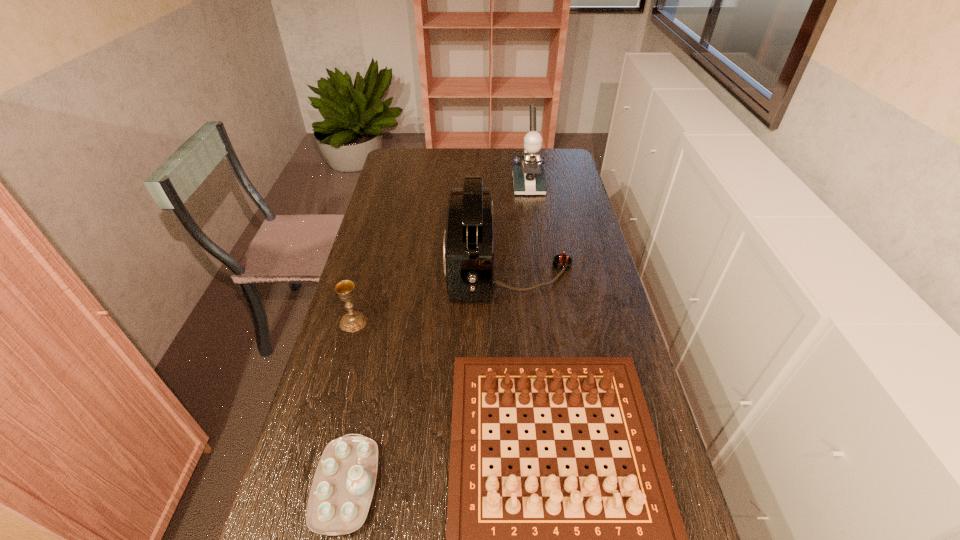
At what (x,y) coordinates should I click in order to perform the action: click on free area in between the chinaware and the microscope. Please return your answer as a coordinate pair (x, y). This screenshot has height=540, width=960. Looking at the image, I should click on (437, 336).

Where is `vacant area that lies between the chinaware and the chalice`? The height and width of the screenshot is (540, 960). vacant area that lies between the chinaware and the chalice is located at coordinates (349, 404).

The image size is (960, 540). In order to click on free space between the second farthest object and the shortest object in this screenshot , I will do (x=428, y=377).

Identify the location of free spot between the radio receiver and the chinaware. This screenshot has height=540, width=960. (428, 377).

Locate an element on the screen. The height and width of the screenshot is (540, 960). the third closest object to the shortest object is located at coordinates (468, 245).

You are a GUI agent. You are given a task and a screenshot of the screen. Output one action in this format:
    pyautogui.click(x=<x>, y=<y>)
    Task: Click on the object that is the second closest to the gameboard
    
    Given the screenshot: What is the action you would take?
    pyautogui.click(x=468, y=245)

Locate an element on the screen. This screenshot has height=540, width=960. free space that satisfies the following two spatial constraints: 1. on the front side of the chinaware; 2. on the right side of the third shortest object is located at coordinates (308, 486).

You are a GUI agent. You are given a task and a screenshot of the screen. Output one action in this format:
    pyautogui.click(x=<x>, y=<y>)
    Task: Click on the free location that satisfies the following two spatial constraints: 1. at the eyepiece of the microscope; 2. on the front-facing side of the radio receiver
    Image resolution: width=960 pixels, height=540 pixels.
    Given the screenshot: What is the action you would take?
    pyautogui.click(x=540, y=267)